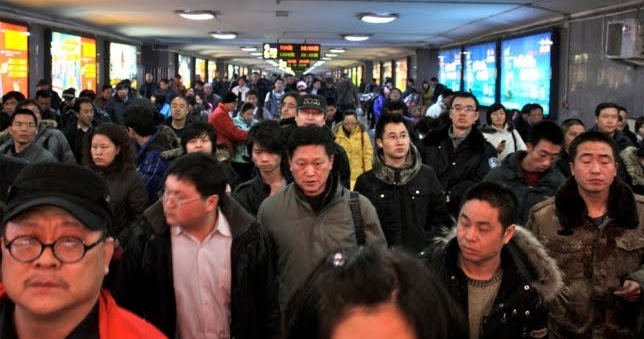
Find the location of a particular element. The height and width of the screenshot is (339, 644). metal wall is located at coordinates (627, 40).